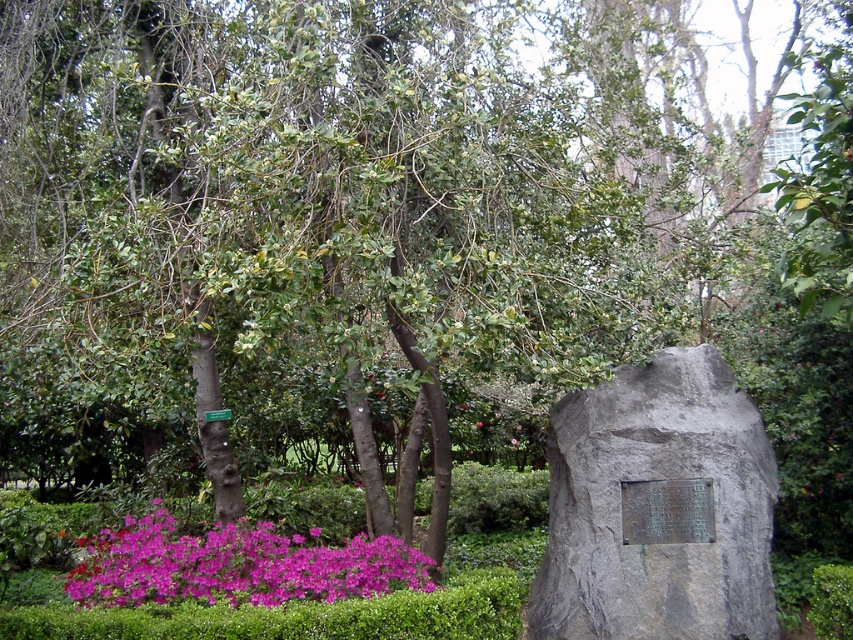
Question: Can you confirm if gray stone plaque at right is positioned to the left of purple matte flowers at lower left?

Choices:
 (A) yes
 (B) no

Answer: (B)

Question: Does gray stone plaque at right come in front of purple matte flowers at lower left?

Choices:
 (A) yes
 (B) no

Answer: (B)

Question: Is gray stone plaque at right to the right of purple matte flowers at lower left from the viewer's perspective?

Choices:
 (A) yes
 (B) no

Answer: (A)

Question: Which object appears closest to the camera in this image?

Choices:
 (A) gray stone plaque at right
 (B) purple matte flowers at lower left

Answer: (B)

Question: Which of the following is the farthest from the observer?

Choices:
 (A) (555, 545)
 (B) (316, 568)

Answer: (A)